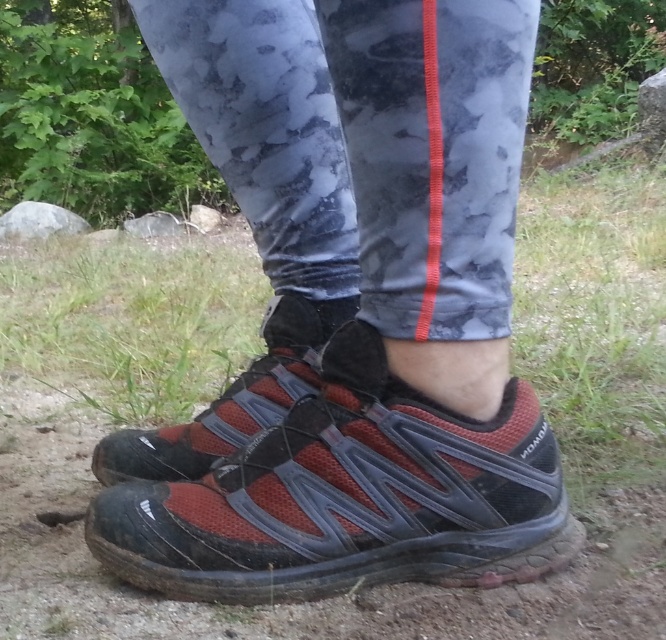
Question: Is matte red mesh shoe at center further to camera compared to red mesh shoe at lower center?

Choices:
 (A) yes
 (B) no

Answer: (B)

Question: Estimate the real-world distances between objects in this image. Which object is closer to the matte red mesh shoe at center?

Choices:
 (A) red mesh shoe at center
 (B) red mesh shoe at lower center

Answer: (B)

Question: Can you confirm if matte red mesh shoe at center is positioned to the left of red mesh shoe at lower center?

Choices:
 (A) no
 (B) yes

Answer: (A)

Question: Which of the following is the closest to the observer?

Choices:
 (A) red mesh shoe at lower center
 (B) matte red mesh shoe at center

Answer: (B)

Question: Can you confirm if matte red mesh shoe at center is bigger than red mesh shoe at lower center?

Choices:
 (A) no
 (B) yes

Answer: (B)

Question: Among these objects, which one is nearest to the camera?

Choices:
 (A) red mesh shoe at lower center
 (B) matte red mesh shoe at center
 (C) red mesh shoe at center

Answer: (B)